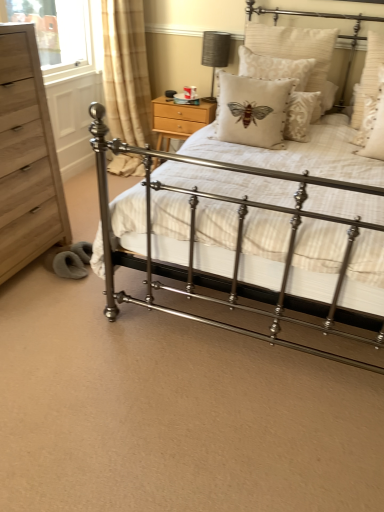
Question: Is white textured pillow with moth design at center, marked as the fifth pillow in a right-to-left arrangement, smaller than light brown wood chest of drawers at left?

Choices:
 (A) no
 (B) yes

Answer: (B)

Question: Is white textured pillow with moth design at center, marked as the fifth pillow in a right-to-left arrangement, located outside light brown wood chest of drawers at left?

Choices:
 (A) no
 (B) yes

Answer: (B)

Question: Is white textured pillow with moth design at center, which appears as the first pillow when viewed from the left, further to camera compared to light brown wood chest of drawers at left?

Choices:
 (A) yes
 (B) no

Answer: (A)

Question: Is light brown wood chest of drawers at left surrounded by white textured pillow with moth design at center, marked as the fifth pillow in a right-to-left arrangement?

Choices:
 (A) no
 (B) yes

Answer: (A)

Question: Is white textured pillow with moth design at center, marked as the fifth pillow in a right-to-left arrangement, to the left of light brown wood chest of drawers at left from the viewer's perspective?

Choices:
 (A) no
 (B) yes

Answer: (A)

Question: Can you confirm if white textured pillow with moth design at center, marked as the fifth pillow in a right-to-left arrangement, is thinner than light brown wood chest of drawers at left?

Choices:
 (A) no
 (B) yes

Answer: (B)

Question: From a real-world perspective, is beige textured pillow at upper right, arranged as the 2th pillow when viewed from the left, physically below matte gray fabric table lamp at upper center?

Choices:
 (A) yes
 (B) no

Answer: (B)

Question: Is beige textured pillow at upper right, the fourth pillow in the right-to-left sequence, outside of matte gray fabric table lamp at upper center?

Choices:
 (A) no
 (B) yes

Answer: (B)

Question: Is beige textured pillow at upper right, the fourth pillow in the right-to-left sequence, far away from matte gray fabric table lamp at upper center?

Choices:
 (A) yes
 (B) no

Answer: (B)

Question: Is beige textured pillow at upper right, the fourth pillow in the right-to-left sequence, positioned before matte gray fabric table lamp at upper center?

Choices:
 (A) no
 (B) yes

Answer: (B)

Question: From a real-world perspective, does beige textured pillow at upper right, arranged as the 2th pillow when viewed from the left, stand above matte gray fabric table lamp at upper center?

Choices:
 (A) no
 (B) yes

Answer: (B)

Question: Considering the relative sizes of beige textured pillow at upper right, arranged as the 2th pillow when viewed from the left, and matte gray fabric table lamp at upper center in the image provided, is beige textured pillow at upper right, arranged as the 2th pillow when viewed from the left, wider than matte gray fabric table lamp at upper center?

Choices:
 (A) no
 (B) yes

Answer: (B)

Question: Is white textured pillow with moth design at center, which appears as the first pillow when viewed from the left, further to camera compared to wooden nightstand at upper center?

Choices:
 (A) no
 (B) yes

Answer: (A)